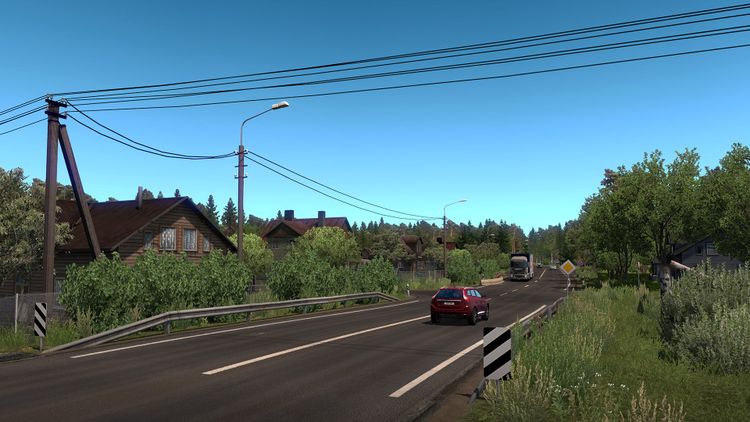
Where is `windows`? windows is located at coordinates (163, 237), (186, 240).